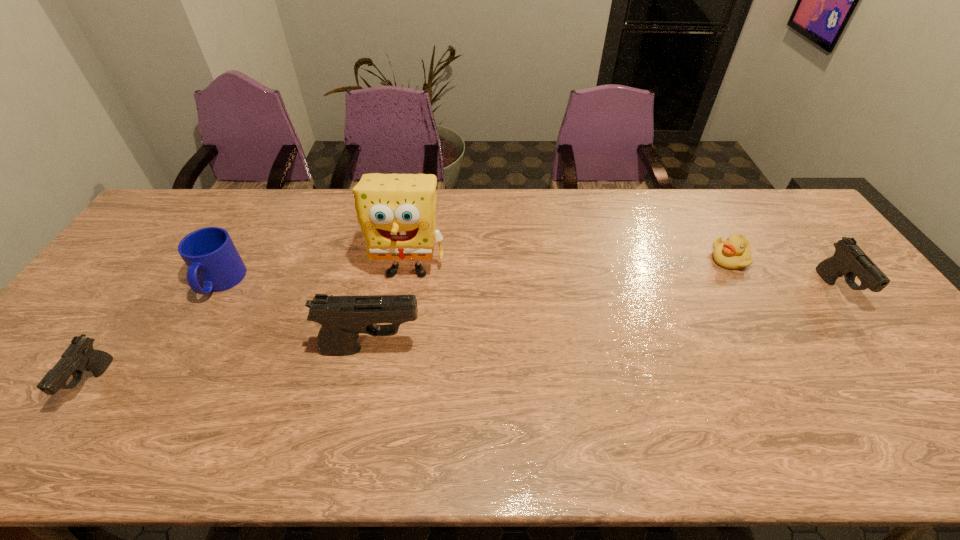
At what (x,y) coordinates should I click in order to perform the action: click on object present at the near left corner. Please return your answer as a coordinate pair (x, y). Looking at the image, I should click on (79, 356).

Where is `free space at the far edge of the desktop`? This screenshot has width=960, height=540. free space at the far edge of the desktop is located at coordinates (513, 192).

Locate an element on the screen. vacant space at the near edge of the desktop is located at coordinates (638, 395).

Image resolution: width=960 pixels, height=540 pixels. What are the coordinates of `free space at the right edge of the desktop` in the screenshot? It's located at (820, 249).

Where is `free space at the far right corner`? This screenshot has height=540, width=960. free space at the far right corner is located at coordinates (808, 232).

You are a GUI agent. You are given a task and a screenshot of the screen. Output one action in this format:
    pyautogui.click(x=<x>, y=<y>)
    Task: Click on the vacant space that is in between the shortest object and the rightmost pistol
    The image size is (960, 540).
    Given the screenshot: What is the action you would take?
    pyautogui.click(x=783, y=274)

Find the location of `empty location between the shortest object and the tallest object`. empty location between the shortest object and the tallest object is located at coordinates (568, 264).

Identify the location of vacant space that's between the mug and the rightmost pistol. (528, 286).

At what (x,y) coordinates should I click in order to perform the action: click on unoccupied area between the fifth tallest object and the tallest object. Please return your answer as a coordinate pair (x, y). Looking at the image, I should click on (251, 326).

Locate an element on the screen. Image resolution: width=960 pixels, height=540 pixels. free space that is in between the second tallest object and the duckling is located at coordinates (551, 303).